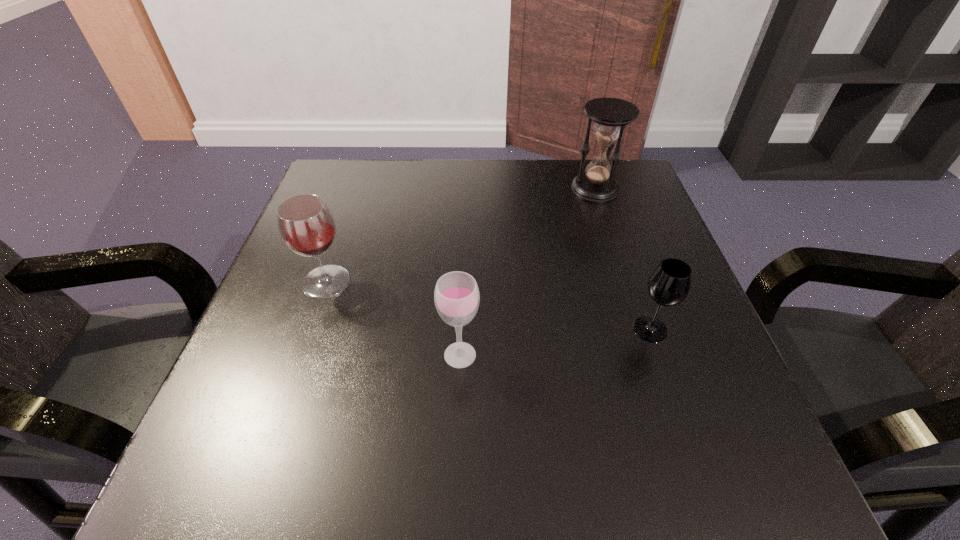
The image size is (960, 540). I want to click on vacant space that's between the rightmost wineglass and the second object from left to right, so click(x=555, y=342).

This screenshot has height=540, width=960. I want to click on free area in between the second farthest object and the rightmost wineglass, so click(489, 306).

You are a GUI agent. You are given a task and a screenshot of the screen. Output one action in this format:
    pyautogui.click(x=<x>, y=<y>)
    Task: Click on the free spot between the rightmost wineglass and the hourglass
    This screenshot has height=540, width=960.
    Given the screenshot: What is the action you would take?
    pyautogui.click(x=623, y=259)

Identify the location of vacant point located between the second object from left to right and the hourglass. (528, 272).

Where is `free space that is in between the second object from left to right and the farthest wineglass`? This screenshot has width=960, height=540. free space that is in between the second object from left to right and the farthest wineglass is located at coordinates (394, 319).

The height and width of the screenshot is (540, 960). What are the coordinates of `free space between the rightmost wineglass and the farthest wineglass` in the screenshot? It's located at (489, 306).

You are a GUI agent. You are given a task and a screenshot of the screen. Output one action in this format:
    pyautogui.click(x=<x>, y=<y>)
    Task: Click on the free space between the third nearest object and the rightmost wineglass
    
    Given the screenshot: What is the action you would take?
    pyautogui.click(x=489, y=306)

The height and width of the screenshot is (540, 960). Identify the location of free space between the rightmost wineglass and the hourglass. (623, 259).

Identify the location of free spot between the farthest object and the rightmost wineglass. The height and width of the screenshot is (540, 960). (623, 259).

Locate which object is the third closest to the rightmost wineglass. Please provide its 2D coordinates. Your answer should be formatted as a tuple, i.e. [(x, y)], where the tuple contains the x and y coordinates of a point satisfying the conditions above.

[(306, 225)]